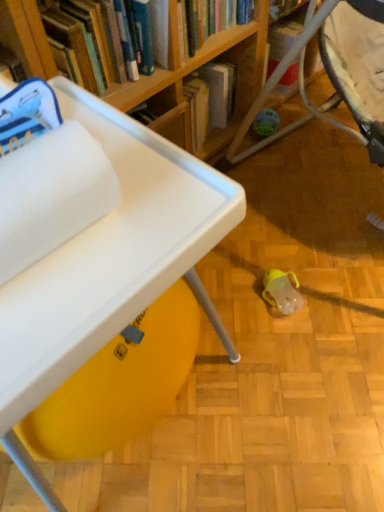
Question: Visually, is white fluffy towel at upper left positioned to the left or to the right of white plastic table at lower left?

Choices:
 (A) right
 (B) left

Answer: (B)

Question: From the image's perspective, is white fluffy towel at upper left above or below white plastic table at lower left?

Choices:
 (A) below
 (B) above

Answer: (B)

Question: Which of these objects is positioned farthest from the white plastic table at lower left?

Choices:
 (A) white fluffy towel at upper left
 (B) wooden bookshelf at upper center

Answer: (B)

Question: Which object is the farthest from the white plastic table at lower left?

Choices:
 (A) white fluffy towel at upper left
 (B) wooden bookshelf at upper center

Answer: (B)